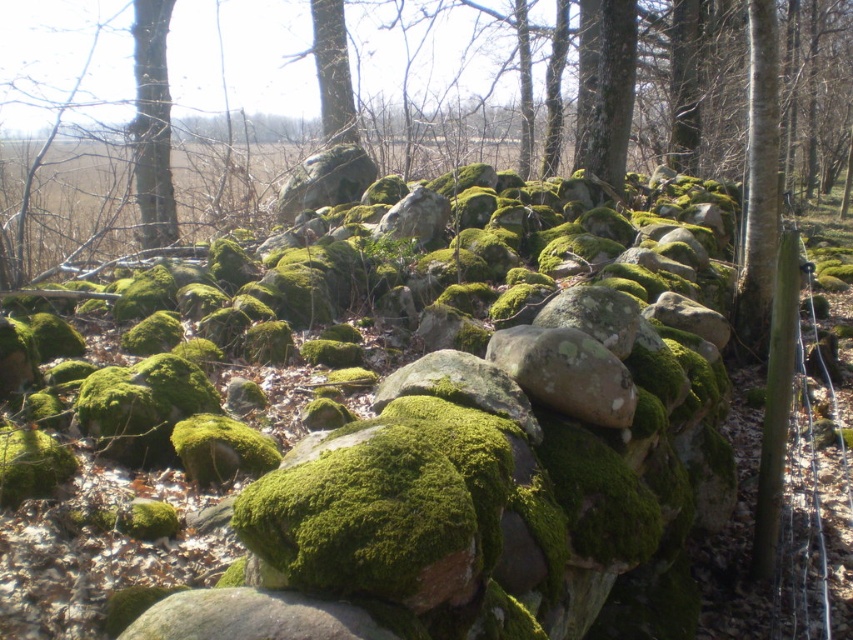
You are a hiker trying to navigate through the forest. You see the green mossy rock at center and the smooth bark tree at left. Which object is smaller in size?

The green mossy rock at center is smaller in size compared to the smooth bark tree at left.

You are a hiker who wants to place a small flag exactly halfway between the green mossy rock at center and the smooth bark tree at left. Based on their positions, where should you place the flag?

The green mossy rock at center is below the smooth bark tree at left, so the flag should be placed halfway between them, which would be along the vertical axis between the two objects.

You are a hiker who wants to place a 2.5 meter long tent between yourself and the green mossy rock at center. Is there enough space to set it up without the tent touching the rock?

The distance between you and the green mossy rock at center is 2.29 meters, which is shorter than the 2.5 meter tent. Therefore, there isn